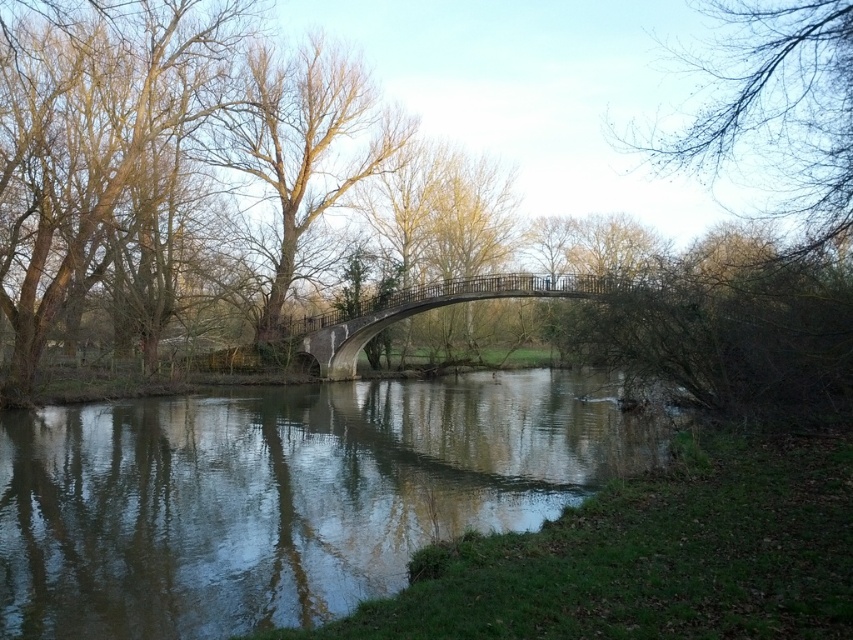
Can you confirm if bare branches at upper right is smaller than stone gray bridge at center?

Yes, bare branches at upper right is smaller than stone gray bridge at center.

Does bare branches at upper right lie in front of stone gray bridge at center?

Yes, it is in front of stone gray bridge at center.

Is point (773, 28) positioned after point (480, 298)?

No, (773, 28) is in front of (480, 298).

At what (x,y) coordinates should I click in order to perform the action: click on bare branches at upper right. Please return your answer as a coordinate pair (x, y). Looking at the image, I should click on tap(778, 112).

Looking at this image, does bare wood tree at center appear on the left side of stone gray bridge at center?

Indeed, bare wood tree at center is positioned on the left side of stone gray bridge at center.

Can you confirm if bare wood tree at center is thinner than stone gray bridge at center?

Yes.

The image size is (853, 640). Describe the element at coordinates (300, 144) in the screenshot. I see `bare wood tree at center` at that location.

This screenshot has height=640, width=853. Find the location of `bare wood tree at center`. bare wood tree at center is located at coordinates (300, 144).

Which is above, smooth reflective water at center or bare wood tree at center?

bare wood tree at center is higher up.

Is smooth reflective water at center thinner than bare wood tree at center?

In fact, smooth reflective water at center might be wider than bare wood tree at center.

Is point (213, 500) positioned behind point (253, 45)?

No.

Locate an element on the screen. This screenshot has height=640, width=853. smooth reflective water at center is located at coordinates (283, 493).